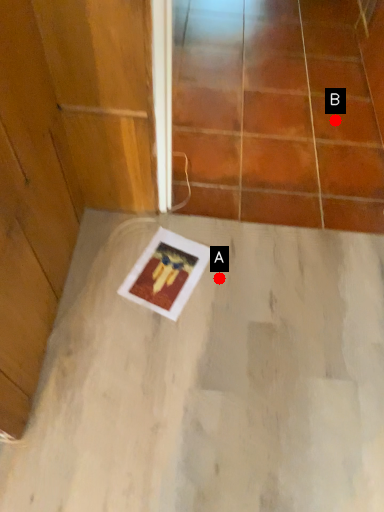
Question: Two points are circled on the image, labeled by A and B beside each circle. Among these points, which one is farthest from the camera?

Choices:
 (A) A is further
 (B) B is further

Answer: (B)